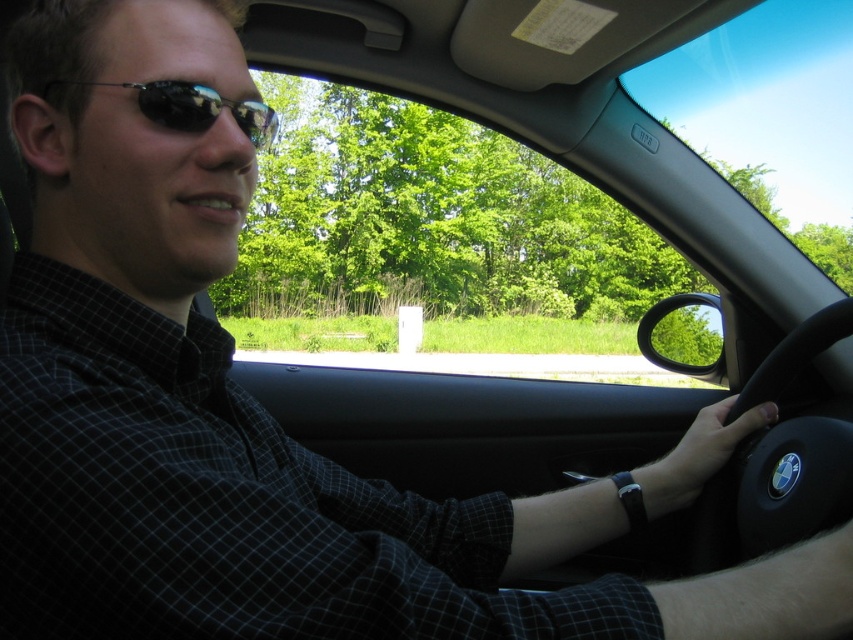
Between black leather steering wheel at lower right and sunglasses at left, which one appears on the left side from the viewer's perspective?

Positioned to the left is sunglasses at left.

Is black leather steering wheel at lower right positioned in front of sunglasses at left?

No, black leather steering wheel at lower right is further to the viewer.

Does point (799, 531) lie in front of point (253, 115)?

No, it is not.

The image size is (853, 640). In order to click on black leather steering wheel at lower right in this screenshot , I will do `click(775, 492)`.